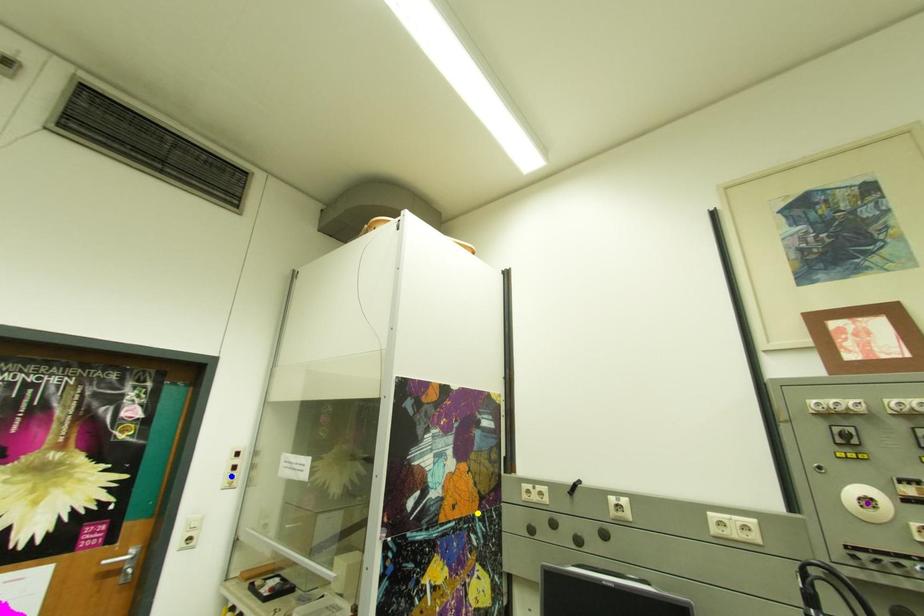
Order these from nearest to farthest:
A) blue point
B) yellow point
C) purple point

purple point < yellow point < blue point